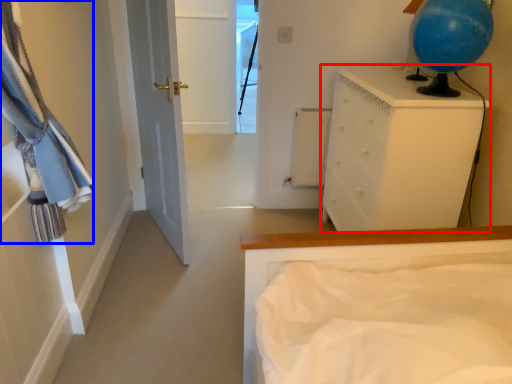
Question: Which object appears closest to the camera in this image, chest of drawers (highlighted by a red box) or laundry (highlighted by a blue box)?

Choices:
 (A) chest of drawers
 (B) laundry

Answer: (B)